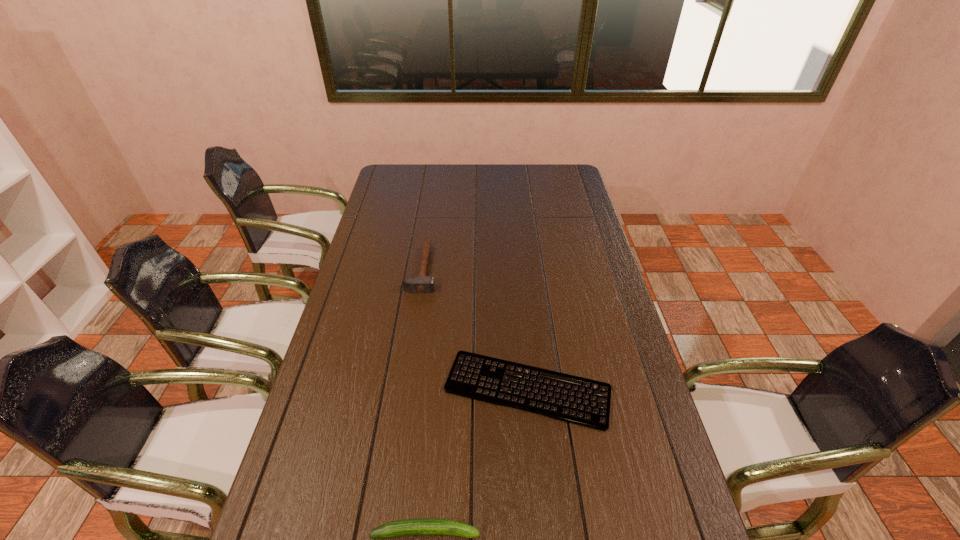
You are a GUI agent. You are given a task and a screenshot of the screen. Output one action in this format:
    pyautogui.click(x=<x>, y=<y>)
    Task: Click on the hammer
    
    Given the screenshot: What is the action you would take?
    pyautogui.click(x=414, y=284)

Identify the location of the tallest object. Image resolution: width=960 pixels, height=540 pixels. (414, 284).

Where is `the shortest object`? The width and height of the screenshot is (960, 540). the shortest object is located at coordinates (577, 400).

Image resolution: width=960 pixels, height=540 pixels. Identify the location of computer keyboard. (577, 400).

Where is `free space located on the striking surface of the tallest object`? The height and width of the screenshot is (540, 960). free space located on the striking surface of the tallest object is located at coordinates (489, 269).

Where is `free space located 0.080m on the back of the computer keyboard`? The width and height of the screenshot is (960, 540). free space located 0.080m on the back of the computer keyboard is located at coordinates (522, 332).

At what (x,y) coordinates should I click in order to perform the action: click on object at the right edge. Please return your answer as a coordinate pair (x, y). This screenshot has height=540, width=960. Looking at the image, I should click on (577, 400).

I want to click on free region at the far edge, so click(443, 184).

You are a GUI agent. You are given a task and a screenshot of the screen. Output one action in this format:
    pyautogui.click(x=<x>, y=<y>)
    Task: Click on the free space at the left edge of the desktop
    
    Given the screenshot: What is the action you would take?
    pyautogui.click(x=357, y=288)

At what (x,y) coordinates should I click in order to perform the action: click on free space at the right edge of the desktop. Please return your answer as a coordinate pair (x, y). This screenshot has width=960, height=540. Looking at the image, I should click on 614,286.